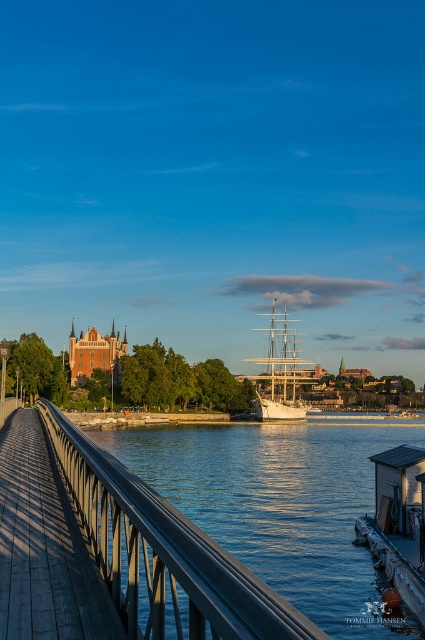
You are standing at the waterfront and want to take a photo of the metallic gray rail at center and the white wooden ship at center. If your camera can focus on objects up to 400 feet away, will both objects be in focus?

The metallic gray rail at center is 367.42 feet away from the white wooden ship at center. Since the camera can focus up to 400 feet, both objects will be within the focus range and thus in focus.

You are standing at the wooden dock at left and want to take a photo of the waterfront scene. The camera is 26.20 meters away from you. Is the camera within a 50 meter range for your photo to be in focus?

The wooden dock at left and camera are 26.20 meters apart from each other. Since 26.20 meters is less than 50 meters, the camera is within the 50 meter range, so the photo will be in focus.